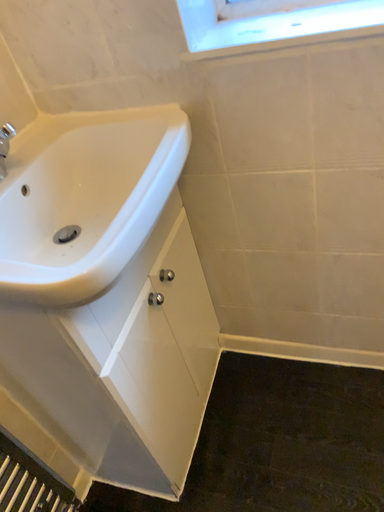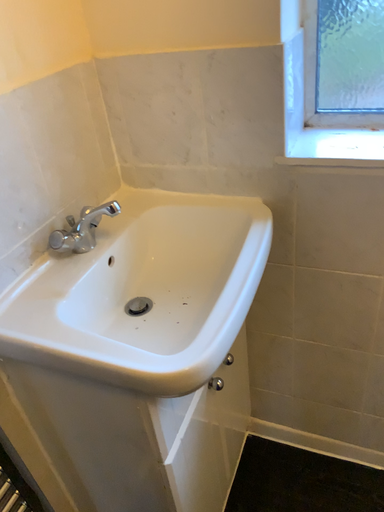
Question: How did the camera likely rotate when shooting the video?

Choices:
 (A) rotated upward
 (B) rotated downward

Answer: (A)